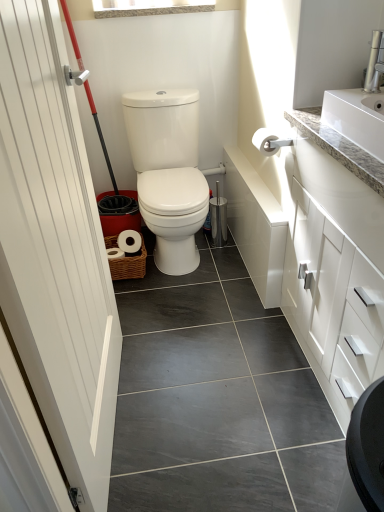
Question: Is the position of silver metallic faucet at upper right more distant than that of white wood door at left?

Choices:
 (A) no
 (B) yes

Answer: (B)

Question: Can white wood door at left be found inside silver metallic faucet at upper right?

Choices:
 (A) yes
 (B) no

Answer: (B)

Question: From a real-world perspective, is silver metallic faucet at upper right physically below white wood door at left?

Choices:
 (A) yes
 (B) no

Answer: (B)

Question: Is silver metallic faucet at upper right far from white wood door at left?

Choices:
 (A) yes
 (B) no

Answer: (A)

Question: Is silver metallic faucet at upper right taller than white wood door at left?

Choices:
 (A) no
 (B) yes

Answer: (A)

Question: Considering the positions of white glossy toilet at center and white matte toilet paper at center in the image, is white glossy toilet at center taller or shorter than white matte toilet paper at center?

Choices:
 (A) tall
 (B) short

Answer: (A)

Question: Would you say white glossy toilet at center is to the left or to the right of white matte toilet paper at center in the picture?

Choices:
 (A) right
 (B) left

Answer: (B)

Question: From a real-world perspective, is white glossy toilet at center physically located above or below white matte toilet paper at center?

Choices:
 (A) above
 (B) below

Answer: (B)

Question: Considering their positions, is white glossy toilet at center located in front of or behind white matte toilet paper at center?

Choices:
 (A) behind
 (B) front

Answer: (A)

Question: Is white matte toilet paper at center to the left or to the right of woven brown basket at lower center in the image?

Choices:
 (A) right
 (B) left

Answer: (A)

Question: Is white matte toilet paper at center situated inside woven brown basket at lower center or outside?

Choices:
 (A) inside
 (B) outside

Answer: (B)

Question: In the image, is white matte toilet paper at center positioned in front of or behind woven brown basket at lower center?

Choices:
 (A) front
 (B) behind

Answer: (A)

Question: Is white matte toilet paper at center bigger or smaller than woven brown basket at lower center?

Choices:
 (A) big
 (B) small

Answer: (B)

Question: Would you say white wood door at left is to the left or to the right of white glossy cabinet at upper right in the picture?

Choices:
 (A) right
 (B) left

Answer: (B)

Question: From a real-world perspective, relative to white glossy cabinet at upper right, is white wood door at left vertically above or below?

Choices:
 (A) below
 (B) above

Answer: (B)